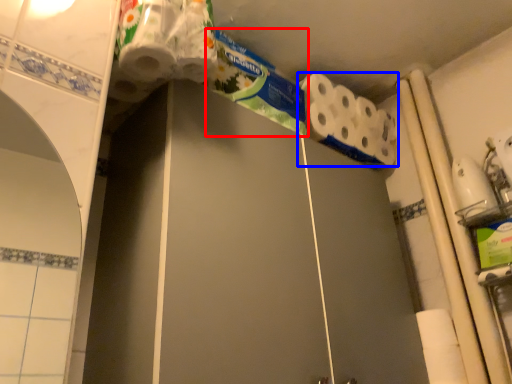
Question: Which object is further to the camera taking this photo, toothpaste (highlighted by a red box) or toilet paper (highlighted by a blue box)?

Choices:
 (A) toothpaste
 (B) toilet paper

Answer: (B)